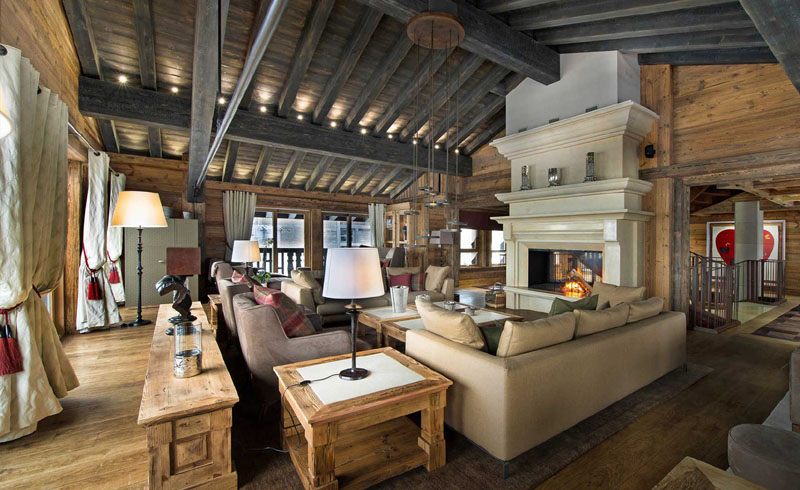
The image size is (800, 490). What are the coordinates of `shade` in the screenshot? It's located at (378, 269).